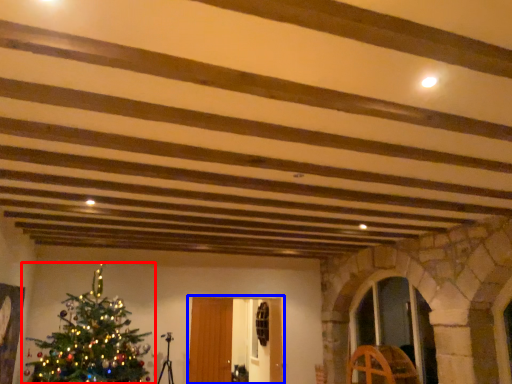
Question: Among these objects, which one is farthest to the camera, christmas tree (highlighted by a red box) or glass door (highlighted by a blue box)?

Choices:
 (A) christmas tree
 (B) glass door

Answer: (B)